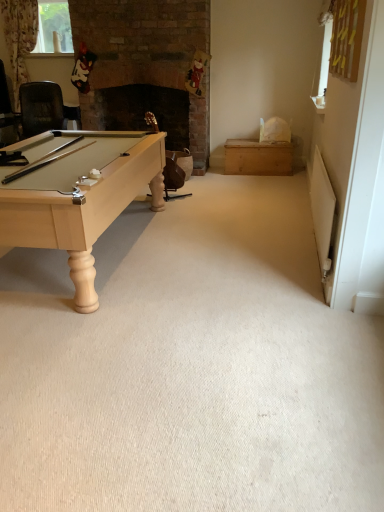
Question: From their relative heights in the image, would you say wooden swivel chair at center is taller or shorter than clear glass window at upper left?

Choices:
 (A) tall
 (B) short

Answer: (A)

Question: From the image's perspective, is wooden swivel chair at center located above or below clear glass window at upper left?

Choices:
 (A) above
 (B) below

Answer: (B)

Question: Estimate the real-world distances between objects in this image. Which object is farther from the wooden swivel chair at center?

Choices:
 (A) wooden chest at right
 (B) clear glass window at upper left

Answer: (B)

Question: Considering the real-world distances, which object is farthest from the clear glass window at upper left?

Choices:
 (A) wooden chest at right
 (B) wooden swivel chair at center

Answer: (A)